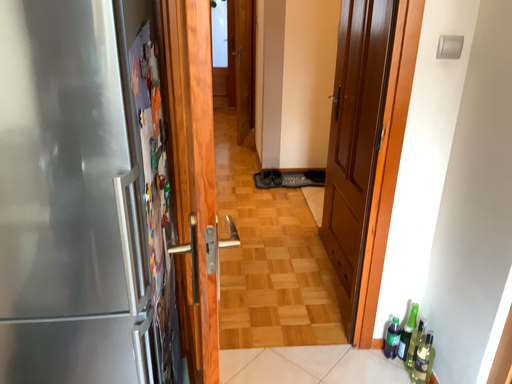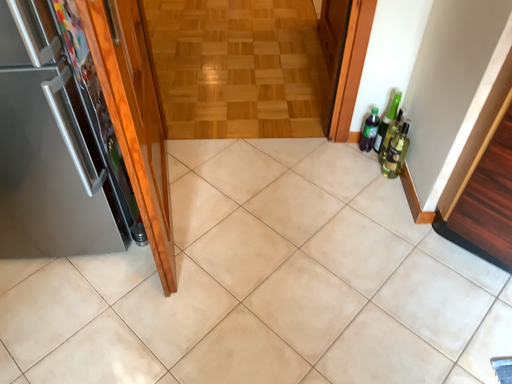
Question: How did the camera likely rotate when shooting the video?

Choices:
 (A) rotated upward
 (B) rotated downward

Answer: (B)